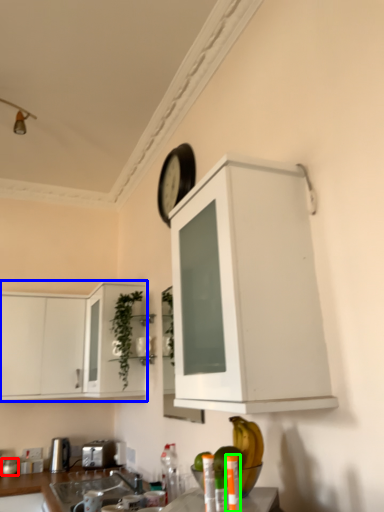
Question: Based on their relative distances, which object is farther from appliance (highlighted by a red box)? Choose from cabinetry (highlighted by a blue box) and bottle (highlighted by a green box).

Choices:
 (A) cabinetry
 (B) bottle

Answer: (B)